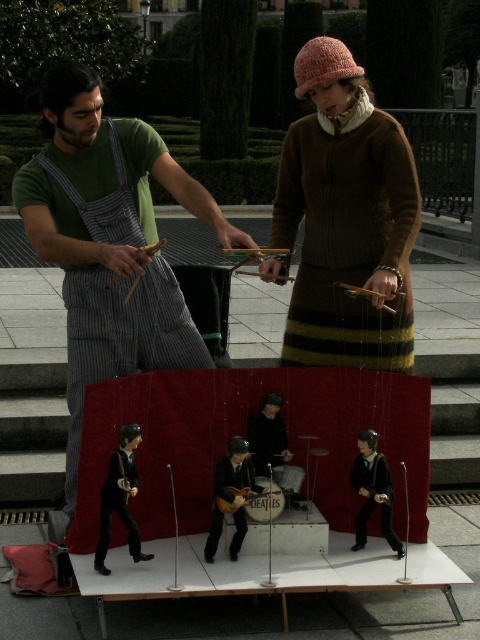
You are a street performer who needs to place a knitted brown sweater at center and a wooden acoustic guitar at center on a 1.2 meter wide stage. Can both items fit side by side on the stage?

The knitted brown sweater at center is wider than the wooden acoustic guitar at center. However, without knowing their exact widths, it is impossible to determine if both can fit on the 1.2 meter stage. More information is needed.

You are a spectator at the street performance and want to take a photo of both the green cotton shirt at center and the knitted brown sweater at center. Which one should you focus on first if you want to capture them from left to right in the order they appear?

You should focus on the green cotton shirt at center first because it is positioned to the left of the knitted brown sweater at center, so capturing them from left to right would start with the green cotton shirt at center.

You are a photographer trying to capture a clear photo of both the green cotton shirt at center and the wooden acoustic guitar at center from the audience area. Given their sizes, which object will appear larger in your photo?

The green cotton shirt at center will appear larger in the photo since it is much taller than the wooden acoustic guitar at center.